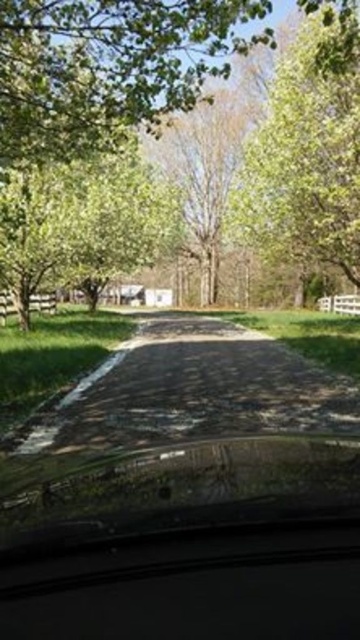
You are driving on the dark asphalt driveway at center and want to park under the green leafy tree at center. Is the tree positioned in a way that would allow you to park underneath it?

The green leafy tree at center is located above the dark asphalt driveway at center, so yes, you can park the vehicle under the tree since it is positioned directly above the driveway.